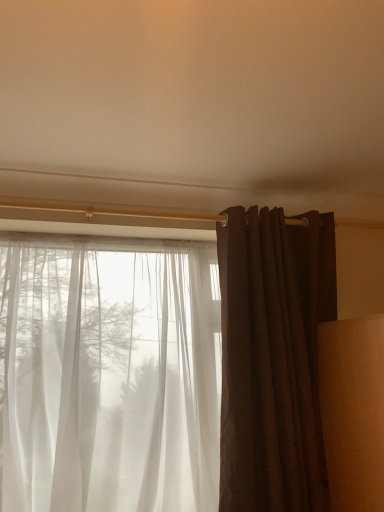
The width and height of the screenshot is (384, 512). Describe the element at coordinates (107, 379) in the screenshot. I see `sheer white curtain at left, arranged as the 1th curtain when viewed from the left` at that location.

Locate an element on the screen. sheer white curtain at left, which is counted as the second curtain, starting from the right is located at coordinates coord(107,379).

Identify the location of matte brown curtain at right, the second curtain in the left-to-right sequence. Image resolution: width=384 pixels, height=512 pixels. (272, 359).

Image resolution: width=384 pixels, height=512 pixels. Describe the element at coordinates (272, 359) in the screenshot. I see `matte brown curtain at right, the 1th curtain when ordered from right to left` at that location.

The height and width of the screenshot is (512, 384). I want to click on sheer white curtain at left, arranged as the 1th curtain when viewed from the left, so pyautogui.click(x=107, y=379).

Considering the positions of objects sheer white curtain at left, which is counted as the second curtain, starting from the right, and matte brown curtain at right, the 1th curtain when ordered from right to left, in the image provided, who is more to the right, sheer white curtain at left, which is counted as the second curtain, starting from the right, or matte brown curtain at right, the 1th curtain when ordered from right to left,?

Positioned to the right is matte brown curtain at right, the 1th curtain when ordered from right to left.

Who is more distant, sheer white curtain at left, which is counted as the second curtain, starting from the right, or matte brown curtain at right, the 1th curtain when ordered from right to left?

matte brown curtain at right, the 1th curtain when ordered from right to left, is behind.

Which point is more distant from viewer, (x=195, y=432) or (x=251, y=274)?

The point (x=195, y=432) is more distant.

From the image's perspective, would you say sheer white curtain at left, which is counted as the second curtain, starting from the right, is shown under matte brown curtain at right, the 1th curtain when ordered from right to left?

Indeed, from the image's perspective, sheer white curtain at left, which is counted as the second curtain, starting from the right, is shown beneath matte brown curtain at right, the 1th curtain when ordered from right to left.

Based on the photo, from a real-world perspective, which object rests below the other?

sheer white curtain at left, which is counted as the second curtain, starting from the right.

Is sheer white curtain at left, arranged as the 1th curtain when viewed from the left, wider or thinner than matte brown curtain at right, the 1th curtain when ordered from right to left?

Considering their sizes, sheer white curtain at left, arranged as the 1th curtain when viewed from the left, looks broader than matte brown curtain at right, the 1th curtain when ordered from right to left.

Considering the sizes of sheer white curtain at left, arranged as the 1th curtain when viewed from the left, and matte brown curtain at right, the second curtain in the left-to-right sequence, in the image, is sheer white curtain at left, arranged as the 1th curtain when viewed from the left, taller or shorter than matte brown curtain at right, the second curtain in the left-to-right sequence,?

Considering their sizes, sheer white curtain at left, arranged as the 1th curtain when viewed from the left, has less height than matte brown curtain at right, the second curtain in the left-to-right sequence.

Does sheer white curtain at left, arranged as the 1th curtain when viewed from the left, have a larger size compared to matte brown curtain at right, the 1th curtain when ordered from right to left?

Yes, sheer white curtain at left, arranged as the 1th curtain when viewed from the left, is bigger than matte brown curtain at right, the 1th curtain when ordered from right to left.

Is matte brown curtain at right, the second curtain in the left-to-right sequence, completely or partially inside sheer white curtain at left, arranged as the 1th curtain when viewed from the left?

Definitely not — matte brown curtain at right, the second curtain in the left-to-right sequence, is not inside sheer white curtain at left, arranged as the 1th curtain when viewed from the left.

Is sheer white curtain at left, arranged as the 1th curtain when viewed from the left, next to matte brown curtain at right, the second curtain in the left-to-right sequence, and touching it?

No, sheer white curtain at left, arranged as the 1th curtain when viewed from the left, is not in contact with matte brown curtain at right, the second curtain in the left-to-right sequence.

Is sheer white curtain at left, arranged as the 1th curtain when viewed from the left, facing towards matte brown curtain at right, the second curtain in the left-to-right sequence?

No, sheer white curtain at left, arranged as the 1th curtain when viewed from the left, is not aimed at matte brown curtain at right, the second curtain in the left-to-right sequence.

Can you tell me how much sheer white curtain at left, arranged as the 1th curtain when viewed from the left, and matte brown curtain at right, the second curtain in the left-to-right sequence, differ in facing direction?

There is a 1.79-degree angle between the facing directions of sheer white curtain at left, arranged as the 1th curtain when viewed from the left, and matte brown curtain at right, the second curtain in the left-to-right sequence.

This screenshot has width=384, height=512. I want to click on curtain lying in front of the matte brown curtain at right, the second curtain in the left-to-right sequence, so click(x=107, y=379).

Between matte brown curtain at right, the 1th curtain when ordered from right to left, and sheer white curtain at left, which is counted as the second curtain, starting from the right, which one appears on the right side from the viewer's perspective?

matte brown curtain at right, the 1th curtain when ordered from right to left.

Considering their positions, is matte brown curtain at right, the 1th curtain when ordered from right to left, located in front of or behind sheer white curtain at left, arranged as the 1th curtain when viewed from the left?

Visually, matte brown curtain at right, the 1th curtain when ordered from right to left, is located behind sheer white curtain at left, arranged as the 1th curtain when viewed from the left.

Which is in front, point (274, 434) or point (214, 380)?

The point (274, 434) is more forward.

From the image's perspective, which one is positioned higher, matte brown curtain at right, the 1th curtain when ordered from right to left, or sheer white curtain at left, which is counted as the second curtain, starting from the right?

matte brown curtain at right, the 1th curtain when ordered from right to left, from the image's perspective.

From a real-world perspective, which object rests below the other?

sheer white curtain at left, which is counted as the second curtain, starting from the right.

Based on the photo, is matte brown curtain at right, the second curtain in the left-to-right sequence, thinner than sheer white curtain at left, arranged as the 1th curtain when viewed from the left?

Yes.

Does matte brown curtain at right, the 1th curtain when ordered from right to left, have a greater height compared to sheer white curtain at left, arranged as the 1th curtain when viewed from the left?

Correct, matte brown curtain at right, the 1th curtain when ordered from right to left, is much taller as sheer white curtain at left, arranged as the 1th curtain when viewed from the left.

Looking at the image, does matte brown curtain at right, the 1th curtain when ordered from right to left, seem bigger or smaller compared to sheer white curtain at left, which is counted as the second curtain, starting from the right?

matte brown curtain at right, the 1th curtain when ordered from right to left, is smaller than sheer white curtain at left, which is counted as the second curtain, starting from the right.

Is matte brown curtain at right, the 1th curtain when ordered from right to left, not within sheer white curtain at left, arranged as the 1th curtain when viewed from the left?

That's correct, matte brown curtain at right, the 1th curtain when ordered from right to left, is outside of sheer white curtain at left, arranged as the 1th curtain when viewed from the left.

Is the surface of matte brown curtain at right, the second curtain in the left-to-right sequence, in direct contact with sheer white curtain at left, arranged as the 1th curtain when viewed from the left?

No.

Could you tell me if matte brown curtain at right, the 1th curtain when ordered from right to left, is facing sheer white curtain at left, arranged as the 1th curtain when viewed from the left?

No.

What's the angular difference between matte brown curtain at right, the 1th curtain when ordered from right to left, and sheer white curtain at left, which is counted as the second curtain, starting from the right,'s facing directions?

They differ by 1.79 degrees in their facing directions.

Could you measure the distance between matte brown curtain at right, the 1th curtain when ordered from right to left, and sheer white curtain at left, arranged as the 1th curtain when viewed from the left?

17.18 inches.

Where is `curtain on the left side of matte brown curtain at right, the 1th curtain when ordered from right to left`? This screenshot has width=384, height=512. curtain on the left side of matte brown curtain at right, the 1th curtain when ordered from right to left is located at coordinates (107, 379).

The width and height of the screenshot is (384, 512). In the image, there is a matte brown curtain at right, the second curtain in the left-to-right sequence. Identify the location of curtain below it (from the image's perspective). (107, 379).

Where is `curtain behind the sheer white curtain at left, arranged as the 1th curtain when viewed from the left`? This screenshot has height=512, width=384. curtain behind the sheer white curtain at left, arranged as the 1th curtain when viewed from the left is located at coordinates (272, 359).